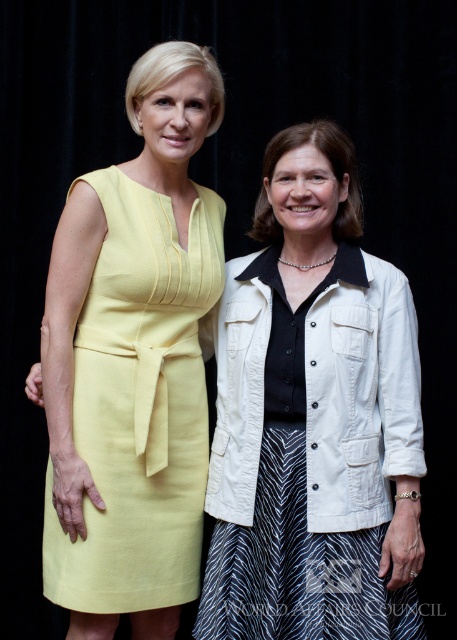
Is white textured jacket at center further to camera compared to linen yellow dress at left?

No, white textured jacket at center is closer to the viewer.

Does white textured jacket at center appear on the left side of linen yellow dress at left?

No, white textured jacket at center is not to the left of linen yellow dress at left.

Is point (367, 490) positioned behind point (125, 326)?

No, (367, 490) is closer to viewer.

Locate an element on the screen. This screenshot has width=457, height=640. white textured jacket at center is located at coordinates (313, 419).